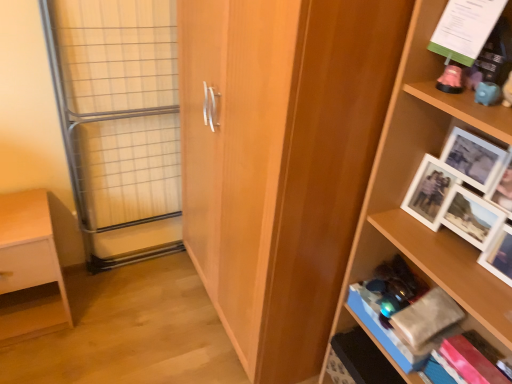
You are a GUI agent. You are given a task and a screenshot of the screen. Output one action in this format:
    pyautogui.click(x=<x>, y=<y>)
    Task: Click on the white matte wooden shelf at lower left, acting as the first shelf starting from the left
    The height and width of the screenshot is (384, 512).
    Given the screenshot: What is the action you would take?
    pyautogui.click(x=29, y=268)

Locate an element on the screen. Image resolution: width=512 pixels, height=384 pixels. pink plastic piggy bank at upper right, positioned as the second shelf in left-to-right order is located at coordinates (460, 103).

Considering the points (407, 135) and (410, 89), which point is behind, point (407, 135) or point (410, 89)?

Positioned behind is point (407, 135).

Is wooden shelf at right, which ranks as the 1th shelf in right-to-left order, directly adjacent to pink plastic piggy bank at upper right, which appears as the second shelf when viewed from the right?

wooden shelf at right, which ranks as the 1th shelf in right-to-left order, and pink plastic piggy bank at upper right, which appears as the second shelf when viewed from the right, are clearly separated.

From a real-world perspective, who is located lower, wooden shelf at right, marked as the third shelf in a left-to-right arrangement, or pink plastic piggy bank at upper right, positioned as the second shelf in left-to-right order?

wooden shelf at right, marked as the third shelf in a left-to-right arrangement.

Is pink plastic piggy bank at upper right, which appears as the second shelf when viewed from the right, inside or outside of wooden cupboard at center?

pink plastic piggy bank at upper right, which appears as the second shelf when viewed from the right, is spatially situated outside wooden cupboard at center.

Looking at their sizes, would you say pink plastic piggy bank at upper right, which appears as the second shelf when viewed from the right, is wider or thinner than wooden cupboard at center?

pink plastic piggy bank at upper right, which appears as the second shelf when viewed from the right, is thinner than wooden cupboard at center.

From the image's perspective, relative to wooden cupboard at center, is pink plastic piggy bank at upper right, which appears as the second shelf when viewed from the right, above or below?

Clearly, from the image's perspective, pink plastic piggy bank at upper right, which appears as the second shelf when viewed from the right, is above wooden cupboard at center.

Is pink plastic piggy bank at upper right, positioned as the second shelf in left-to-right order, next to wooden shelf at right, which ranks as the 1th shelf in right-to-left order?

No.

Is pink plastic piggy bank at upper right, positioned as the second shelf in left-to-right order, oriented away from wooden shelf at right, marked as the third shelf in a left-to-right arrangement?

That's right, pink plastic piggy bank at upper right, positioned as the second shelf in left-to-right order, is facing away from wooden shelf at right, marked as the third shelf in a left-to-right arrangement.

The image size is (512, 384). I want to click on shelf in front of the pink plastic piggy bank at upper right, positioned as the second shelf in left-to-right order, so click(x=411, y=180).

Is pink plastic piggy bank at upper right, positioned as the second shelf in left-to-right order, smaller than clear glass door at left?

Correct, pink plastic piggy bank at upper right, positioned as the second shelf in left-to-right order, occupies less space than clear glass door at left.

Is pink plastic piggy bank at upper right, which appears as the second shelf when viewed from the right, positioned with its back to clear glass door at left?

pink plastic piggy bank at upper right, which appears as the second shelf when viewed from the right, is not turned away from clear glass door at left.

Which point is more forward, (x=439, y=67) or (x=83, y=211)?

The point (x=439, y=67) is in front.

How many degrees apart are the facing directions of pink plastic piggy bank at upper right, positioned as the second shelf in left-to-right order, and clear glass door at left?

90.4 degrees separate the facing orientations of pink plastic piggy bank at upper right, positioned as the second shelf in left-to-right order, and clear glass door at left.

Which object is closer to the camera, wooden shelf at right, marked as the third shelf in a left-to-right arrangement, or white matte wooden shelf at lower left, which is counted as the third shelf, starting from the right?

wooden shelf at right, marked as the third shelf in a left-to-right arrangement.

Is wooden shelf at right, which ranks as the 1th shelf in right-to-left order, not near white matte wooden shelf at lower left, acting as the first shelf starting from the left?

Indeed, wooden shelf at right, which ranks as the 1th shelf in right-to-left order, is not near white matte wooden shelf at lower left, acting as the first shelf starting from the left.

Who is shorter, wooden shelf at right, which ranks as the 1th shelf in right-to-left order, or white matte wooden shelf at lower left, which is counted as the third shelf, starting from the right?

white matte wooden shelf at lower left, which is counted as the third shelf, starting from the right.

Is point (350, 254) positioned after point (38, 245)?

No, (350, 254) is closer to viewer.

Based on the photo, measure the distance between wooden shelf at right, which ranks as the 1th shelf in right-to-left order, and clear glass door at left.

wooden shelf at right, which ranks as the 1th shelf in right-to-left order, and clear glass door at left are 3.34 feet apart from each other.

From the image's perspective, is wooden shelf at right, which ranks as the 1th shelf in right-to-left order, under clear glass door at left?

Yes, from the image's perspective, wooden shelf at right, which ranks as the 1th shelf in right-to-left order, is beneath clear glass door at left.

Relative to clear glass door at left, is wooden shelf at right, which ranks as the 1th shelf in right-to-left order, in front or behind?

wooden shelf at right, which ranks as the 1th shelf in right-to-left order, is in front of clear glass door at left.

From the image's perspective, would you say wooden cupboard at center is shown under wooden shelf at right, which ranks as the 1th shelf in right-to-left order?

No, from the image's perspective, wooden cupboard at center is not beneath wooden shelf at right, which ranks as the 1th shelf in right-to-left order.

Based on the photo, is wooden cupboard at center completely or partially outside of wooden shelf at right, which ranks as the 1th shelf in right-to-left order?

Yes, wooden cupboard at center is located beyond the bounds of wooden shelf at right, which ranks as the 1th shelf in right-to-left order.

From a real-world perspective, which object stands above the other?

wooden shelf at right, marked as the third shelf in a left-to-right arrangement.

From a real-world perspective, starting from the pink plastic piggy bank at upper right, which appears as the second shelf when viewed from the right, which shelf is the 1st one below it? Please provide its 2D coordinates.

[(411, 180)]

This screenshot has width=512, height=384. Find the location of `the 1st shelf behind the wooden cupboard at center`. the 1st shelf behind the wooden cupboard at center is located at coordinates (460, 103).

When comparing their distances from wooden cupboard at center, does wooden shelf at right, marked as the third shelf in a left-to-right arrangement, or pink plastic piggy bank at upper right, which appears as the second shelf when viewed from the right, seem closer?

wooden shelf at right, marked as the third shelf in a left-to-right arrangement, lies closer to wooden cupboard at center than the other object.

When comparing their distances from clear glass door at left, does white matte wooden shelf at lower left, which is counted as the third shelf, starting from the right, or pink plastic piggy bank at upper right, which appears as the second shelf when viewed from the right, seem further?

pink plastic piggy bank at upper right, which appears as the second shelf when viewed from the right, is further to clear glass door at left.

Which object lies further to the anchor point wooden cupboard at center, pink plastic piggy bank at upper right, positioned as the second shelf in left-to-right order, or wooden shelf at right, marked as the third shelf in a left-to-right arrangement?

pink plastic piggy bank at upper right, positioned as the second shelf in left-to-right order, lies further to wooden cupboard at center than the other object.

Considering their positions, is pink plastic piggy bank at upper right, which appears as the second shelf when viewed from the right, positioned closer to white matte wooden shelf at lower left, which is counted as the third shelf, starting from the right, than clear glass door at left?

clear glass door at left lies closer to white matte wooden shelf at lower left, which is counted as the third shelf, starting from the right, than the other object.

Based on their spatial positions, is wooden shelf at right, marked as the third shelf in a left-to-right arrangement, or white matte wooden shelf at lower left, which is counted as the third shelf, starting from the right, closer to wooden cupboard at center?

wooden shelf at right, marked as the third shelf in a left-to-right arrangement, is closer to wooden cupboard at center.

Which object lies nearer to the anchor point wooden shelf at right, which ranks as the 1th shelf in right-to-left order, wooden cupboard at center or pink plastic piggy bank at upper right, which appears as the second shelf when viewed from the right?

The object closer to wooden shelf at right, which ranks as the 1th shelf in right-to-left order, is pink plastic piggy bank at upper right, which appears as the second shelf when viewed from the right.

Based on their spatial positions, is clear glass door at left or wooden shelf at right, which ranks as the 1th shelf in right-to-left order, closer to wooden cupboard at center?

Based on the image, wooden shelf at right, which ranks as the 1th shelf in right-to-left order, appears to be nearer to wooden cupboard at center.

From the image, which object appears to be farther from white matte wooden shelf at lower left, acting as the first shelf starting from the left, wooden cupboard at center or wooden shelf at right, which ranks as the 1th shelf in right-to-left order?

wooden shelf at right, which ranks as the 1th shelf in right-to-left order, lies further to white matte wooden shelf at lower left, acting as the first shelf starting from the left, than the other object.

I want to click on cupboard between pink plastic piggy bank at upper right, which appears as the second shelf when viewed from the right, and wooden shelf at right, marked as the third shelf in a left-to-right arrangement, in the vertical direction, so click(x=281, y=161).

Image resolution: width=512 pixels, height=384 pixels. Find the location of `cupboard between clear glass door at left and pink plastic piggy bank at upper right, positioned as the second shelf in left-to-right order, from left to right`. cupboard between clear glass door at left and pink plastic piggy bank at upper right, positioned as the second shelf in left-to-right order, from left to right is located at coordinates (281, 161).

The width and height of the screenshot is (512, 384). What are the coordinates of `glass door located between white matte wooden shelf at lower left, which is counted as the third shelf, starting from the right, and pink plastic piggy bank at upper right, positioned as the second shelf in left-to-right order, in the left-right direction` in the screenshot? It's located at (117, 114).

At what (x,y) coordinates should I click in order to perform the action: click on glass door between white matte wooden shelf at lower left, acting as the first shelf starting from the left, and wooden cupboard at center. Please return your answer as a coordinate pair (x, y). Looking at the image, I should click on (117, 114).